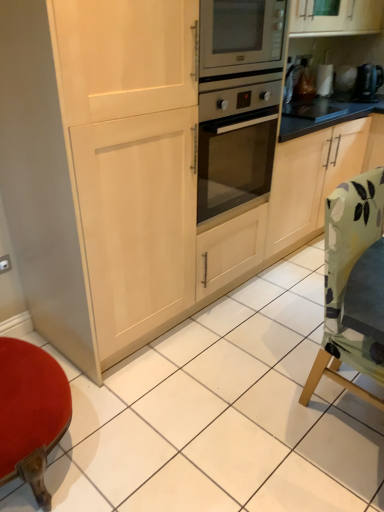
Question: Is green fabric chair at lower right outside metallic black kettle at upper right?

Choices:
 (A) yes
 (B) no

Answer: (A)

Question: Is metallic black kettle at upper right at the back of green fabric chair at lower right?

Choices:
 (A) yes
 (B) no

Answer: (B)

Question: Is green fabric chair at lower right wider than metallic black kettle at upper right?

Choices:
 (A) yes
 (B) no

Answer: (A)

Question: Does green fabric chair at lower right lie in front of metallic black kettle at upper right?

Choices:
 (A) yes
 (B) no

Answer: (A)

Question: Does green fabric chair at lower right have a lesser width compared to metallic black kettle at upper right?

Choices:
 (A) yes
 (B) no

Answer: (B)

Question: Could you tell me if green fabric chair at lower right is facing metallic black kettle at upper right?

Choices:
 (A) no
 (B) yes

Answer: (A)

Question: Is metallic black kettle at upper right bigger than green fabric chair at lower right?

Choices:
 (A) yes
 (B) no

Answer: (B)

Question: Is metallic black kettle at upper right not near green fabric chair at lower right?

Choices:
 (A) yes
 (B) no

Answer: (A)

Question: Can you confirm if metallic black kettle at upper right is shorter than green fabric chair at lower right?

Choices:
 (A) yes
 (B) no

Answer: (A)

Question: Can we say metallic black kettle at upper right lies outside green fabric chair at lower right?

Choices:
 (A) no
 (B) yes

Answer: (B)

Question: From the image's perspective, is metallic black kettle at upper right over green fabric chair at lower right?

Choices:
 (A) yes
 (B) no

Answer: (A)

Question: Is metallic black kettle at upper right turned away from green fabric chair at lower right?

Choices:
 (A) no
 (B) yes

Answer: (A)

Question: From a real-world perspective, relative to green fabric chair at lower right, is metallic black kettle at upper right vertically above or below?

Choices:
 (A) below
 (B) above

Answer: (B)